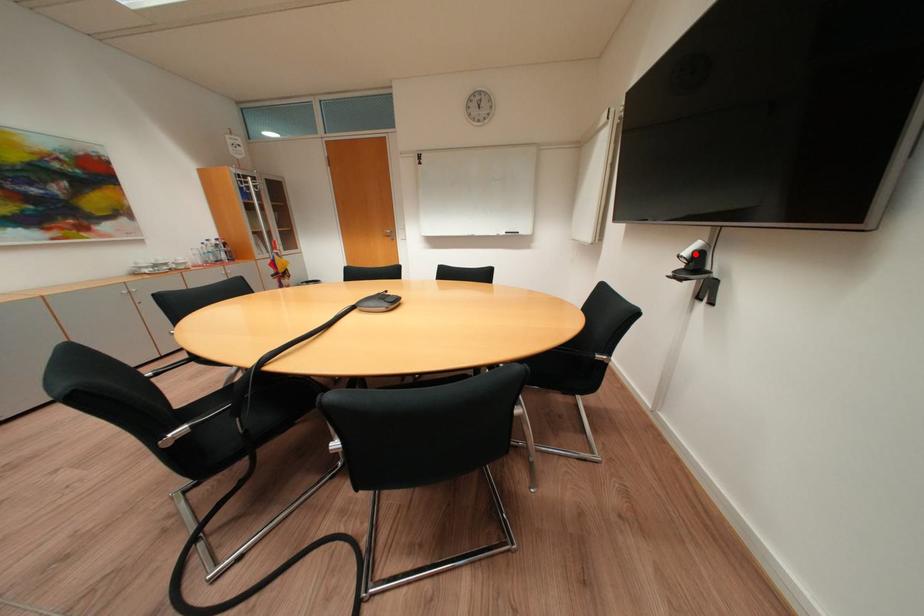
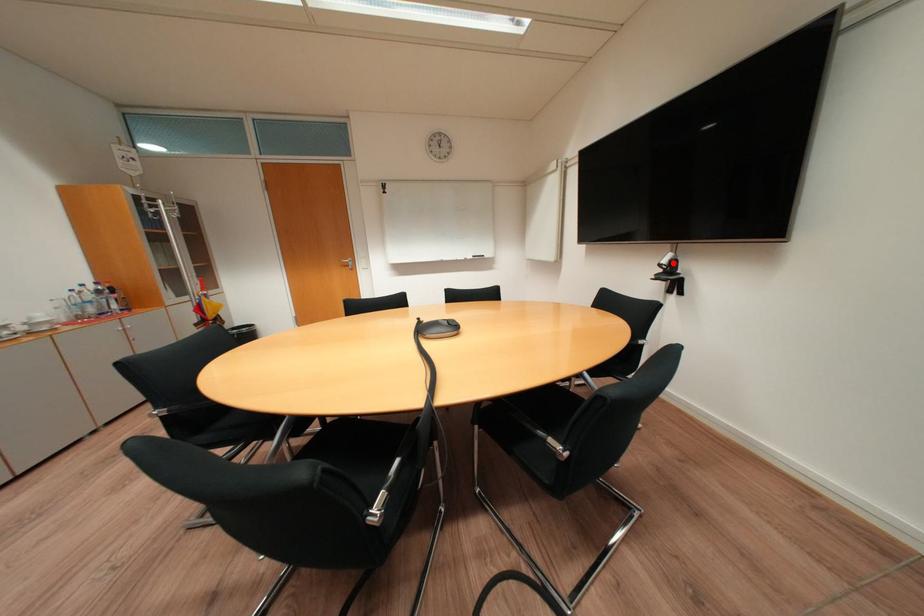
I am providing you with two images of the same scene from different viewpoints. A red point is marked on the first image and another point is marked on the second image. Are the points marked in image1 and image2 representing the same 3D position?

Yes